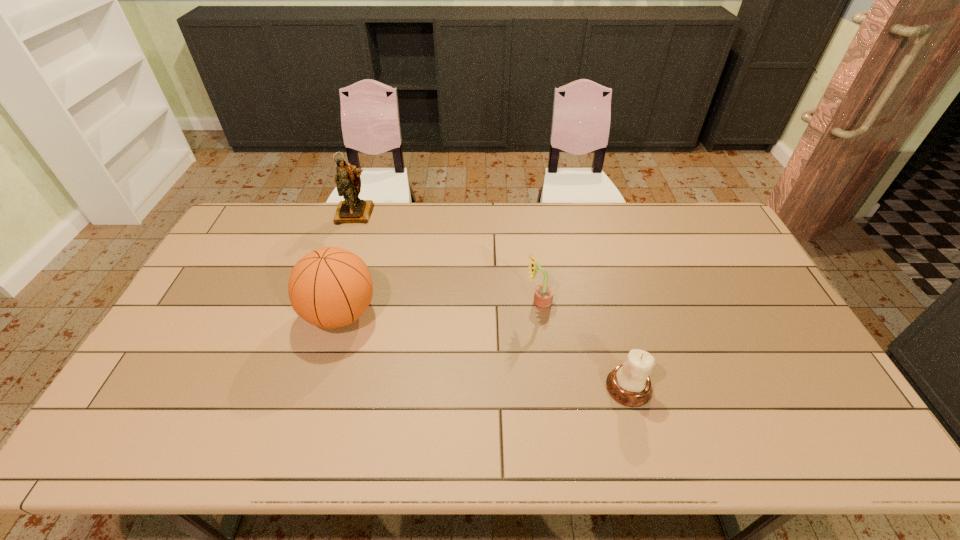
The width and height of the screenshot is (960, 540). Find the location of `free spot that satisfies the following two spatial constraints: 1. on the front-facing side of the farthest object; 2. on the right side of the basketball`. free spot that satisfies the following two spatial constraints: 1. on the front-facing side of the farthest object; 2. on the right side of the basketball is located at coordinates (323, 314).

Find the location of `free location that satisfies the following two spatial constraints: 1. on the front-facing side of the figurine; 2. on the right side of the shortest object`. free location that satisfies the following two spatial constraints: 1. on the front-facing side of the figurine; 2. on the right side of the shortest object is located at coordinates (299, 387).

Where is `free space that satisfies the following two spatial constraints: 1. on the face of the sunflower; 2. on the front side of the basketball`? free space that satisfies the following two spatial constraints: 1. on the face of the sunflower; 2. on the front side of the basketball is located at coordinates pos(540,314).